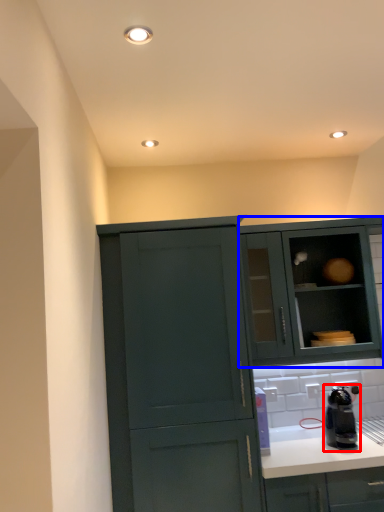
Question: Which object appears farthest to the camera in this image, kitchen appliance (highlighted by a red box) or cabinetry (highlighted by a blue box)?

Choices:
 (A) kitchen appliance
 (B) cabinetry

Answer: (B)